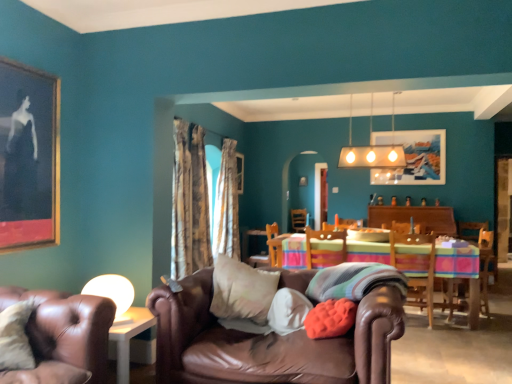
Question: In terms of height, does soft coral cushion at center, positioned as the third pillow in left-to-right order, look taller or shorter compared to brown leather couch at center?

Choices:
 (A) short
 (B) tall

Answer: (A)

Question: Looking at the image, does soft coral cushion at center, positioned as the second pillow in right-to-left order, seem bigger or smaller compared to brown leather couch at center?

Choices:
 (A) small
 (B) big

Answer: (A)

Question: Which object is positioned closest to the wooden chair at center, which is the third chair in front-to-back order?

Choices:
 (A) floral fabric curtain at center, the first curtain positioned from the front
 (B) gold-framed painting at upper left, the 3th picture frame viewed from the back
 (C) brown leather couch at lower left, which appears as the fourth chair when viewed from the back
 (D) matte gold rectangular light fixture at upper center
 (E) silky white curtain at center, the first curtain when ordered from right to left

Answer: (D)

Question: Which is farther from the soft coral cushion at center, positioned as the third pillow in left-to-right order?

Choices:
 (A) soft beige cushion at center, marked as the first pillow in a left-to-right arrangement
 (B) matte gold rectangular light fixture at upper center
 (C) gold-framed painting at upper left, which appears as the 3th picture frame when viewed from the right
 (D) multicolored woven tablecloth at center
 (E) striped fabric pillow at center, positioned as the first pillow in right-to-left order

Answer: (B)